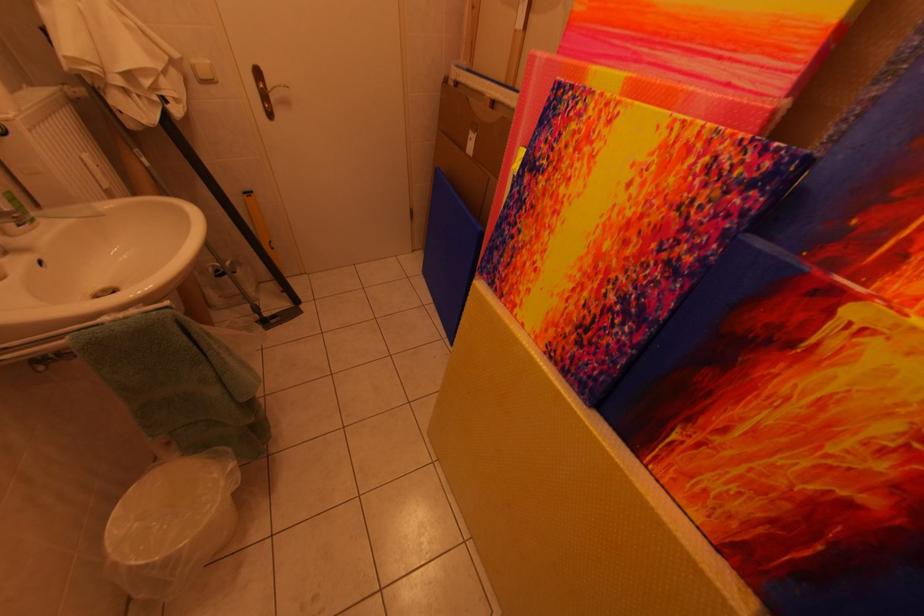
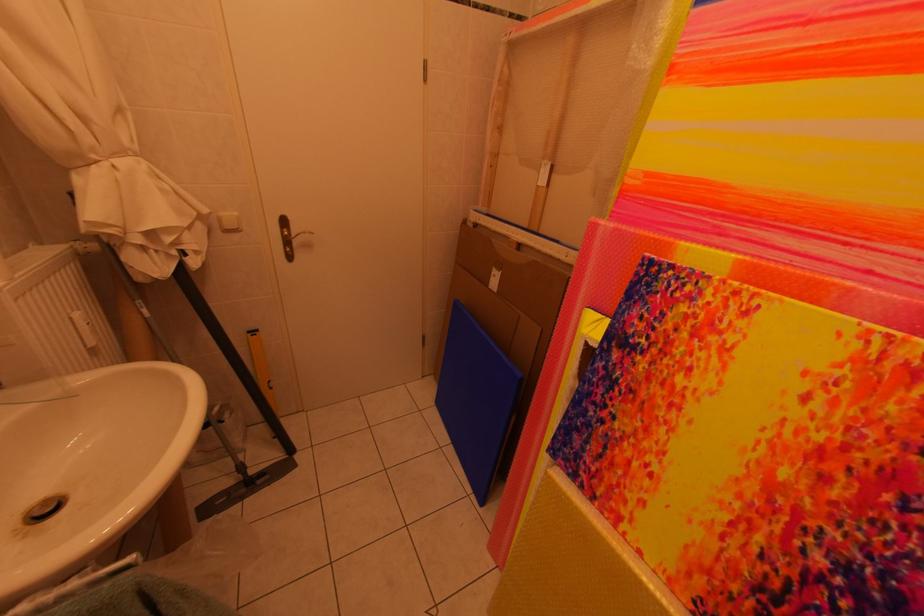
Which direction would the cameraman need to move to produce the second image?

The cameraman walked toward left, forward.